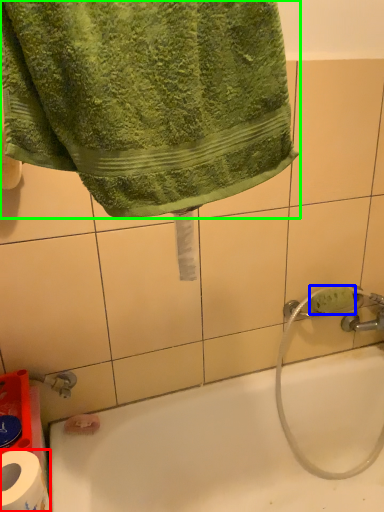
Question: Estimate the real-world distances between objects in this image. Which object is closer to toilet paper (highlighted by a red box), soap (highlighted by a blue box) or towel (highlighted by a green box)?

Choices:
 (A) soap
 (B) towel

Answer: (B)